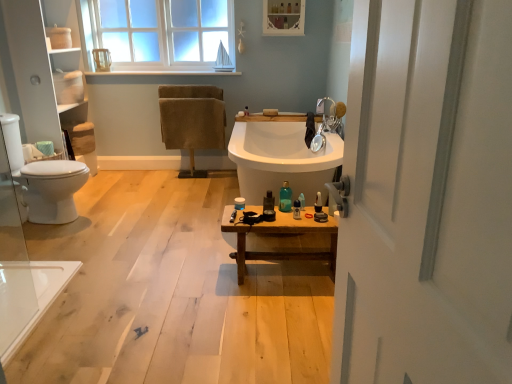
Question: Does translucent glass bottle at center, which is the 3th toiletry in left-to-right order, have a larger size compared to matte white container at center, which appears as the first toiletry when viewed from the left?

Choices:
 (A) no
 (B) yes

Answer: (B)

Question: Is there a large distance between translucent glass bottle at center, which is the 3th toiletry in left-to-right order, and matte white container at center, which appears as the first toiletry when viewed from the left?

Choices:
 (A) yes
 (B) no

Answer: (B)

Question: From the image's perspective, is translucent glass bottle at center, which is the fourth toiletry from right to left, beneath matte white container at center, which is the sixth toiletry in right-to-left order?

Choices:
 (A) no
 (B) yes

Answer: (A)

Question: Is translucent glass bottle at center, which is the fourth toiletry from right to left, positioned with its back to matte white container at center, which appears as the first toiletry when viewed from the left?

Choices:
 (A) yes
 (B) no

Answer: (B)

Question: Does translucent glass bottle at center, which is the fourth toiletry from right to left, appear on the left side of matte white container at center, which appears as the first toiletry when viewed from the left?

Choices:
 (A) yes
 (B) no

Answer: (B)

Question: Is translucent glass bottle at center, which is the 3th toiletry in left-to-right order, next to matte white container at center, which appears as the first toiletry when viewed from the left?

Choices:
 (A) yes
 (B) no

Answer: (B)

Question: Considering the relative sizes of white matte toilet paper at left and translucent plastic bottle at center, marked as the 4th toiletry in a left-to-right arrangement, in the image provided, is white matte toilet paper at left wider than translucent plastic bottle at center, marked as the 4th toiletry in a left-to-right arrangement,?

Choices:
 (A) yes
 (B) no

Answer: (A)

Question: Is translucent plastic bottle at center, which appears as the third toiletry when viewed from the right, located within white matte toilet paper at left?

Choices:
 (A) yes
 (B) no

Answer: (B)

Question: From the image's perspective, is white matte toilet paper at left located above translucent plastic bottle at center, which appears as the third toiletry when viewed from the right?

Choices:
 (A) no
 (B) yes

Answer: (B)

Question: From the image's perspective, is white matte toilet paper at left below translucent plastic bottle at center, which appears as the third toiletry when viewed from the right?

Choices:
 (A) yes
 (B) no

Answer: (B)

Question: Does white matte toilet paper at left have a lesser width compared to translucent plastic bottle at center, which appears as the third toiletry when viewed from the right?

Choices:
 (A) no
 (B) yes

Answer: (A)

Question: Does white matte toilet paper at left have a smaller size compared to translucent plastic bottle at center, which appears as the third toiletry when viewed from the right?

Choices:
 (A) yes
 (B) no

Answer: (B)

Question: Is matte white medicine cabinet at upper center beside matte black razor at center, placed as the 1th toiletry when sorted from right to left?

Choices:
 (A) yes
 (B) no

Answer: (B)